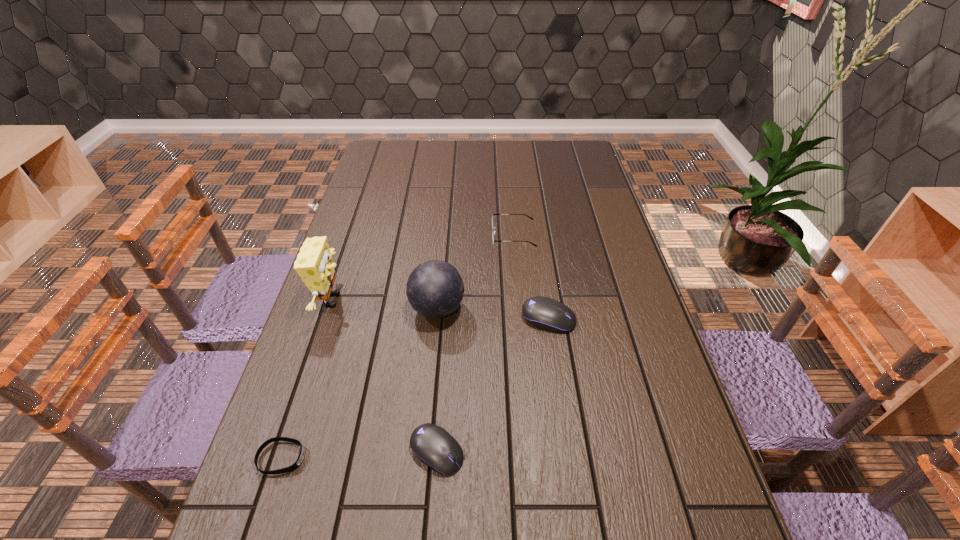
Identify the location of vacant area situated 0.340m on the lenses of the spectacles. (389, 235).

This screenshot has width=960, height=540. Identify the location of vacant region located 0.160m on the lenses of the spectacles. (444, 235).

The width and height of the screenshot is (960, 540). In order to click on vacant space located on the lenses of the spectacles in this screenshot , I will do `click(386, 235)`.

Where is `free space located 0.130m on the face of the tallest object`? The image size is (960, 540). free space located 0.130m on the face of the tallest object is located at coordinates (393, 300).

Where is `free region located on the display of the shortest object`? free region located on the display of the shortest object is located at coordinates (381, 458).

Where is `free space located 0.350m on the grip area of the second tallest object`? The height and width of the screenshot is (540, 960). free space located 0.350m on the grip area of the second tallest object is located at coordinates (592, 309).

Find the location of a particular element. object at the near edge is located at coordinates (433, 445).

Locate an element on the screen. The width and height of the screenshot is (960, 540). sponge that is positioned at the left edge is located at coordinates (314, 263).

You are a GUI agent. You are given a task and a screenshot of the screen. Output one action in this format:
    pyautogui.click(x=<x>, y=<y>)
    Task: Click on the wristband that is positioned at the left edge
    This screenshot has width=960, height=540.
    Given the screenshot: What is the action you would take?
    pyautogui.click(x=300, y=458)

Image resolution: width=960 pixels, height=540 pixels. What are the coordinates of `vacant space at the far edge of the desktop` in the screenshot? It's located at (512, 166).